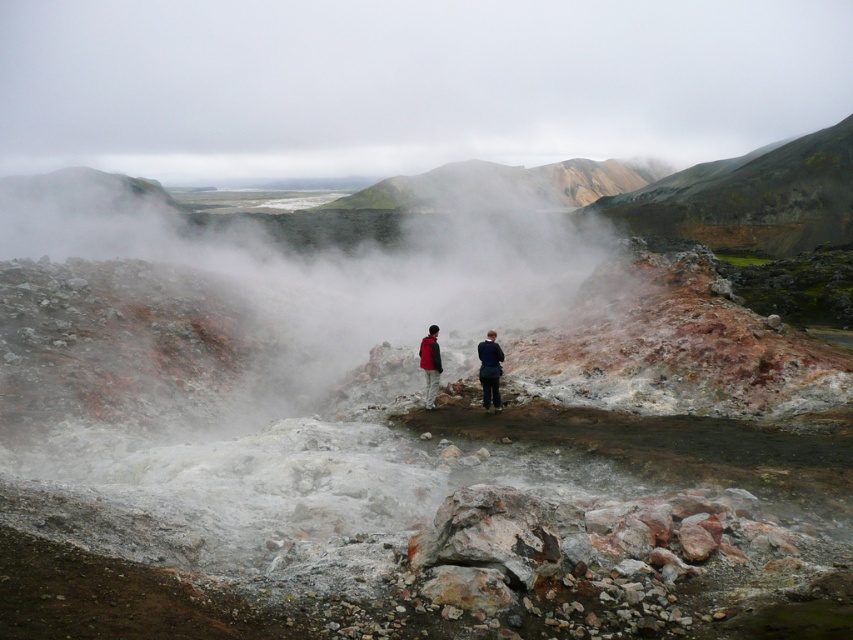
From the picture: You are planning to take a photo of the rustic volcanic rock at upper center and the red jacket at center. Since you want both subjects to be clearly visible in the frame, which object should you focus on first to ensure proper depth of field?

You should focus on the rustic volcanic rock at upper center first because it is taller than the red jacket at center, ensuring both are in focus when using depth of field techniques.